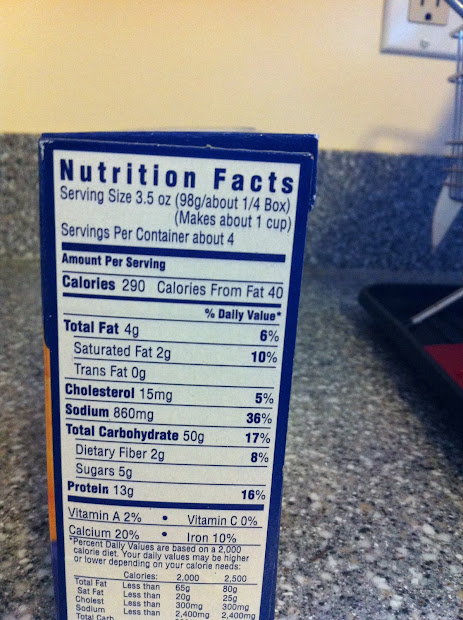
Locate an element on the screen. countertop is located at coordinates (350, 525).